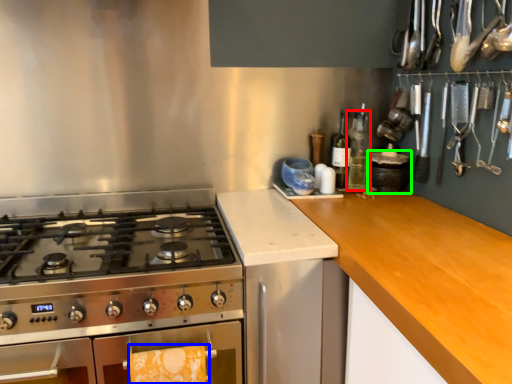
Question: Based on their relative distances, which object is nearer to bottle (highlighted by a red box)? Choose from hand towel (highlighted by a blue box) and kitchen appliance (highlighted by a green box).

Choices:
 (A) hand towel
 (B) kitchen appliance

Answer: (B)